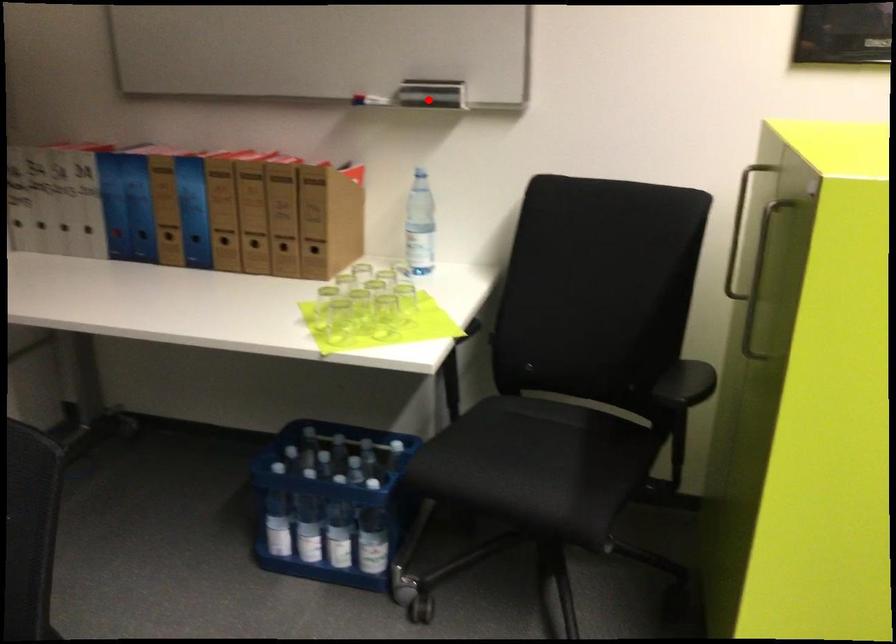
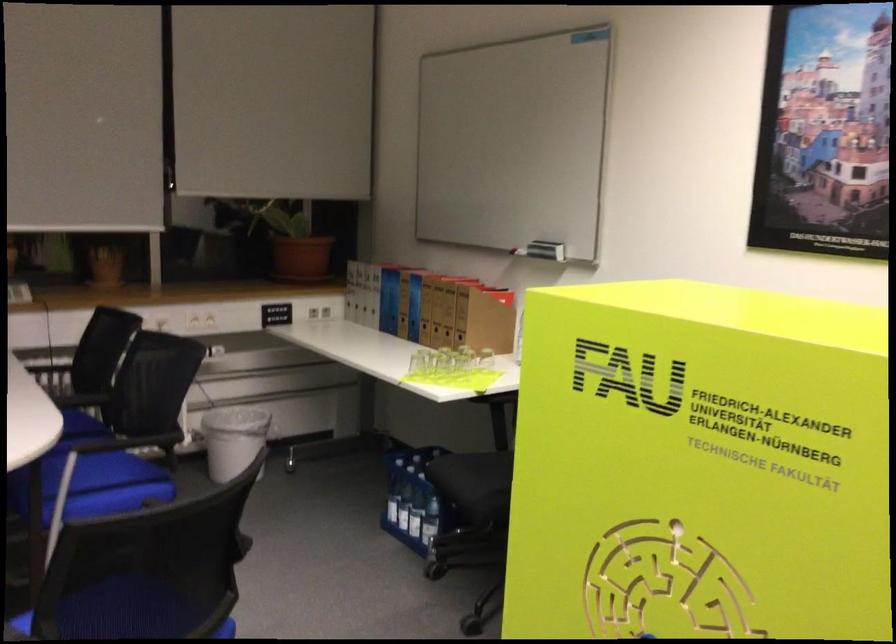
Question: A red point is marked in image1. In image2, is the corresponding 3D point closer to the camera or farther? Reply with the corresponding letter.

Choices:
 (A) The corresponding 3D point is closer.
 (B) The corresponding 3D point is farther.

Answer: (B)